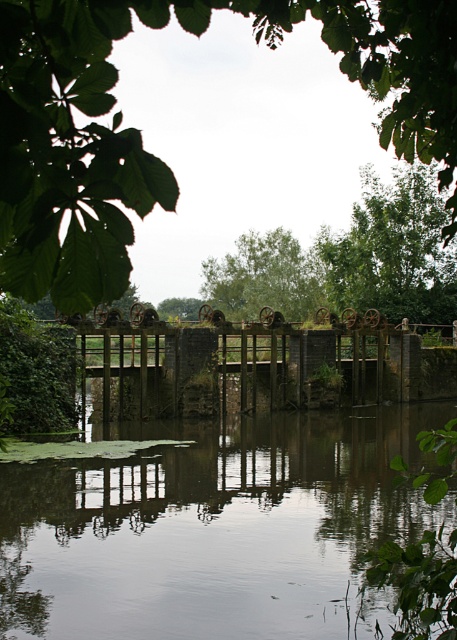
You are standing at the edge of the waterway and see two points marked in the scene. If you were to walk directly towards the point at the bottom right corner, which point would you encounter first, point (344, 348) or point (242, 234)?

You would encounter point (344, 348) first because it is in front of point (242, 234) along your path towards the bottom right corner.

You are a painter who wants to capture the scene in the image. You notice the smooth reflective water at center and the rusty metal fence at center. Which object should you paint first if you want to start with the smaller one?

The smooth reflective water at center has a smaller size compared to the rusty metal fence at center, so you should paint the smooth reflective water at center first.

You are standing on the wooden bridge in the middle of the waterway scene. Looking towards the upper center, you see the green leafy tree at upper center and the rusty metal fence at center. Which object is higher from the ground?

The green leafy tree at upper center is above the rusty metal fence at center, so the green leafy tree at upper center is higher from the ground.